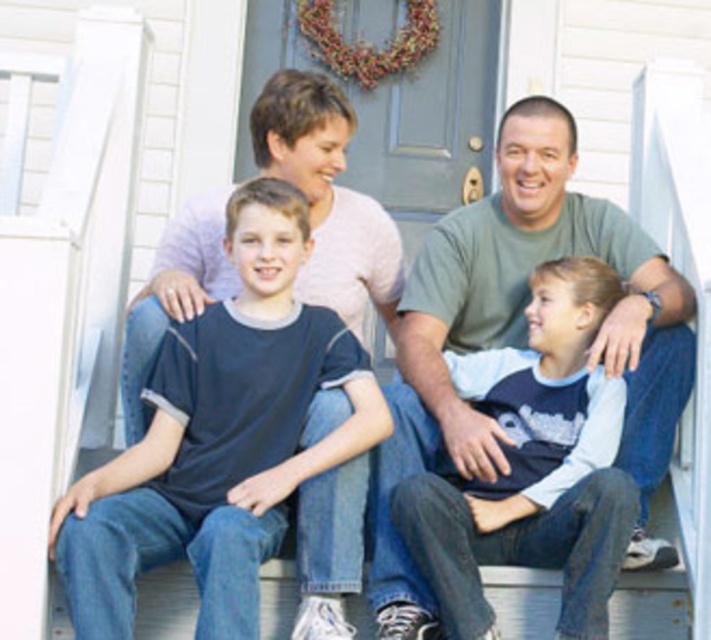
Question: Does dark blue t-shirt at center appear on the left side of green matte shirt at center?

Choices:
 (A) yes
 (B) no

Answer: (A)

Question: Is dark blue t-shirt at center below green matte shirt at center?

Choices:
 (A) yes
 (B) no

Answer: (A)

Question: Which point appears farthest from the camera in this image?

Choices:
 (A) (470, 532)
 (B) (629, 468)
 (C) (321, 308)

Answer: (C)

Question: Is dark blue t-shirt at center in front of blue cotton shirt at center?

Choices:
 (A) no
 (B) yes

Answer: (B)

Question: Among these objects, which one is farthest from the camera?

Choices:
 (A) dark blue t-shirt at center
 (B) green matte shirt at center

Answer: (B)

Question: Based on their relative distances, which object is farther from the green matte shirt at center?

Choices:
 (A) blue cotton shirt at center
 (B) dark blue t-shirt at center

Answer: (B)